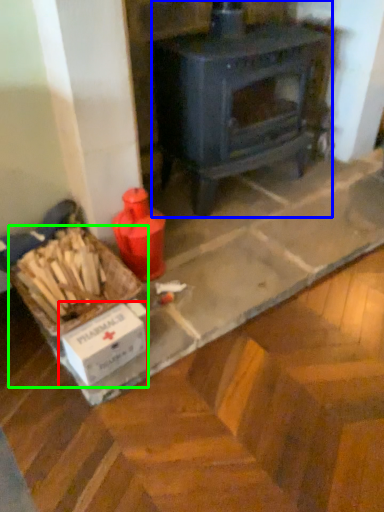
Question: Which object is positioned farthest from cardboard box (highlighted by a red box)? Select from wood burning stove (highlighted by a blue box) and box (highlighted by a green box).

Choices:
 (A) wood burning stove
 (B) box

Answer: (A)